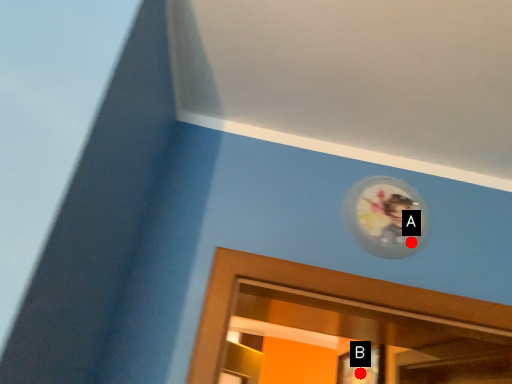
Question: Two points are circled on the image, labeled by A and B beside each circle. Which point is further to the camera?

Choices:
 (A) A is further
 (B) B is further

Answer: (B)